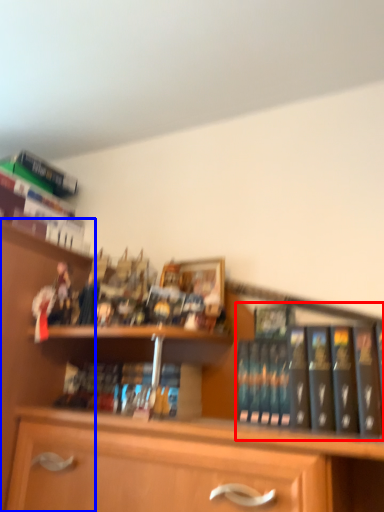
Question: Which point is further to the camera, book (highlighted by a red box) or shelf (highlighted by a blue box)?

Choices:
 (A) book
 (B) shelf

Answer: (A)